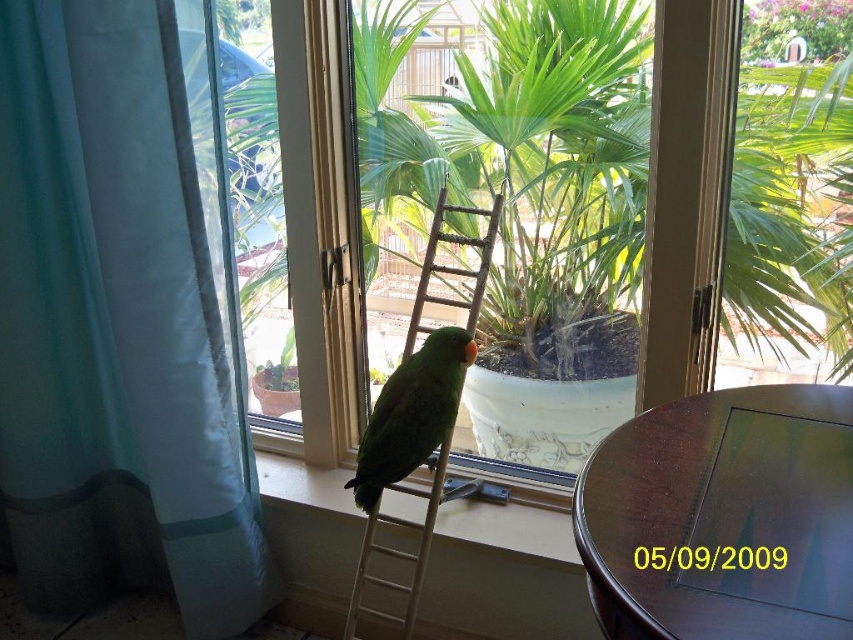
Question: Is green leafy plant at center below white wooden ladder at center?

Choices:
 (A) no
 (B) yes

Answer: (A)

Question: Among these points, which one is nearest to the camera?

Choices:
 (A) (672, 522)
 (B) (425, 369)

Answer: (A)

Question: From the image, what is the correct spatial relationship of mahogany wood round table at lower right in relation to white wooden ladder at center?

Choices:
 (A) right
 (B) left

Answer: (A)

Question: Is white smooth window sill at center further to the viewer compared to green matte parrot at center?

Choices:
 (A) yes
 (B) no

Answer: (A)

Question: Which of the following is the closest to the observer?

Choices:
 (A) (480, 529)
 (B) (19, 102)
 (C) (448, 269)

Answer: (B)

Question: Which of the following is the farthest from the observer?

Choices:
 (A) (202, 595)
 (B) (782, 339)
 (C) (326, 490)

Answer: (C)